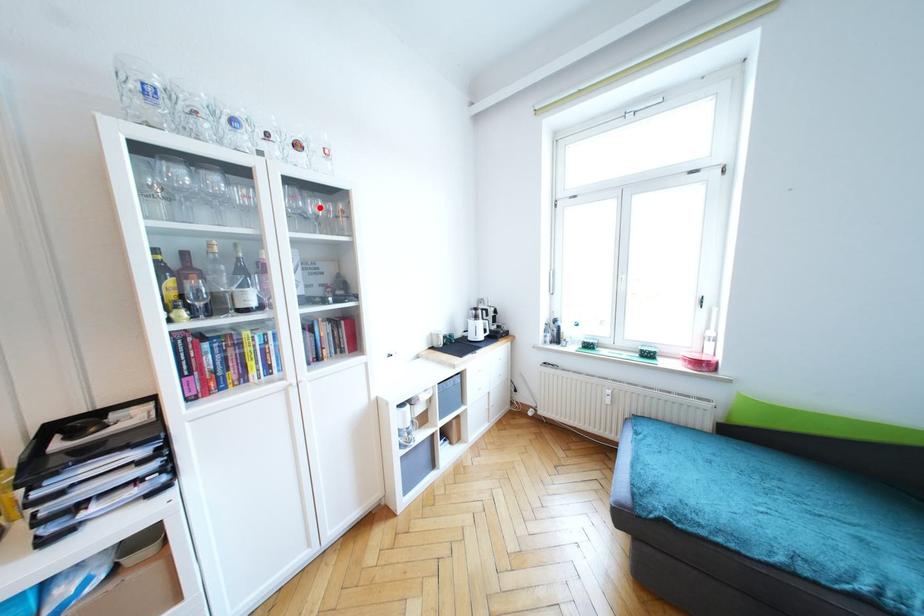
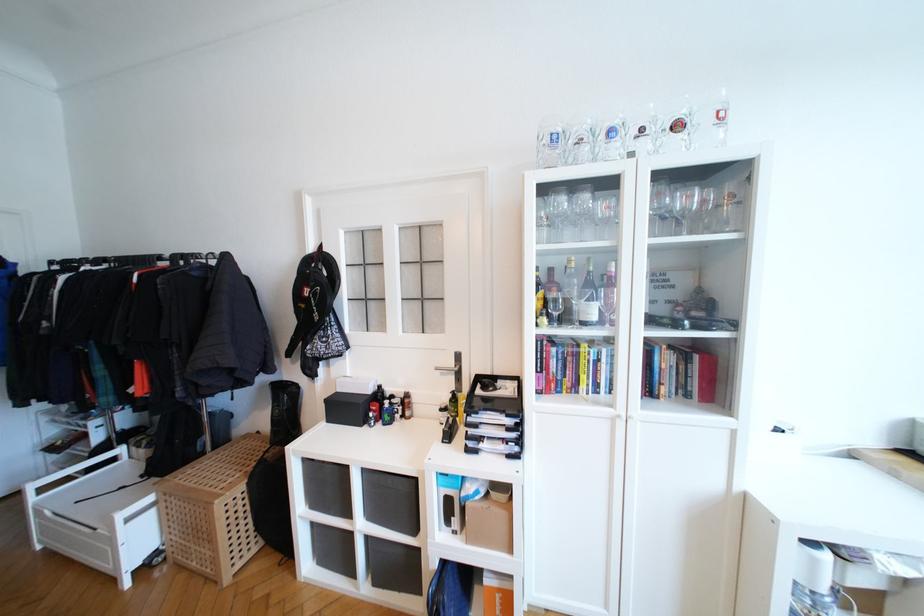
Where in the second image is the point corresponding to the highlighted location from the first image?

(691, 200)